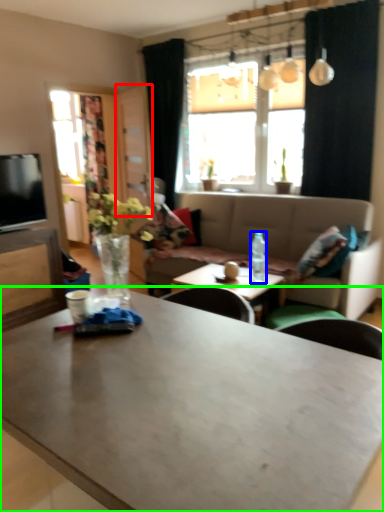
Question: Considering the real-world distances, which object is closest to glass door (highlighted by a red box)? bottle (highlighted by a blue box) or coffee table (highlighted by a green box).

Choices:
 (A) bottle
 (B) coffee table

Answer: (A)